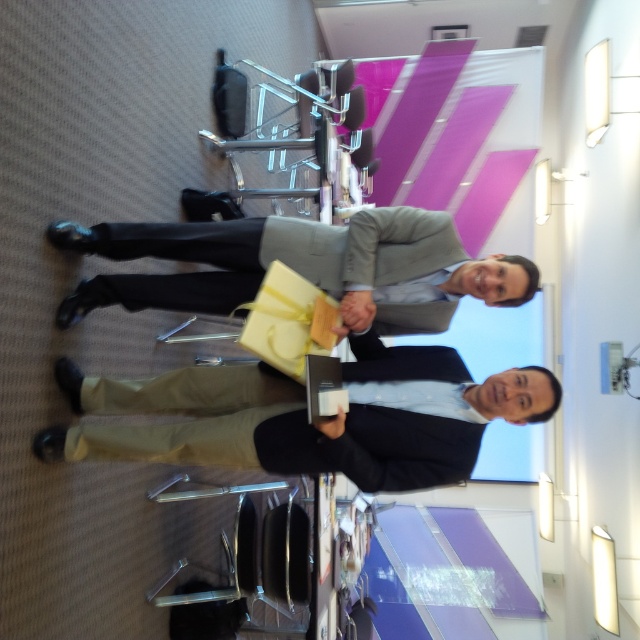
Is matte black book at lower center positioned at the back of matte gray suit at center?

No, it is in front of matte gray suit at center.

Does matte black book at lower center have a smaller size compared to matte gray suit at center?

No.

At what (x,y) coordinates should I click in order to perform the action: click on matte black book at lower center. Please return your answer as a coordinate pair (x, y). This screenshot has height=640, width=640. Looking at the image, I should click on (307, 417).